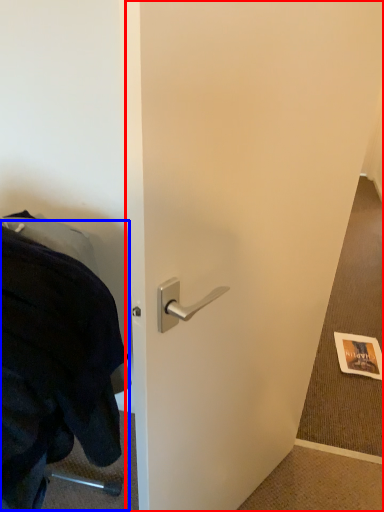
Question: Which of the following is the closest to the observer, door (highlighted by a red box) or blanket (highlighted by a blue box)?

Choices:
 (A) door
 (B) blanket

Answer: (A)